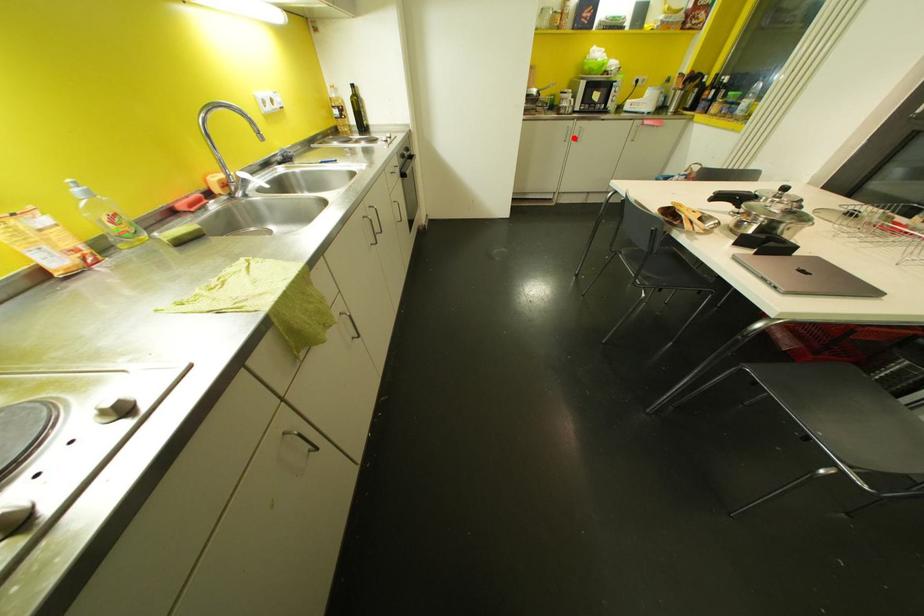
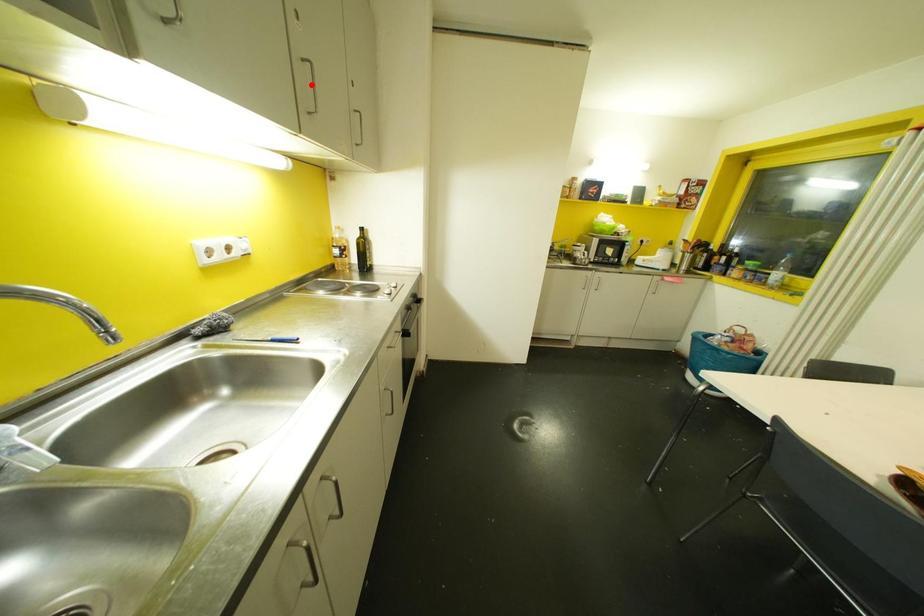
I am providing you with two images of the same scene from different viewpoints. A red point is marked on the first image and another point is marked on the second image. Is the marked point in image1 the same physical position as the marked point in image2?

No